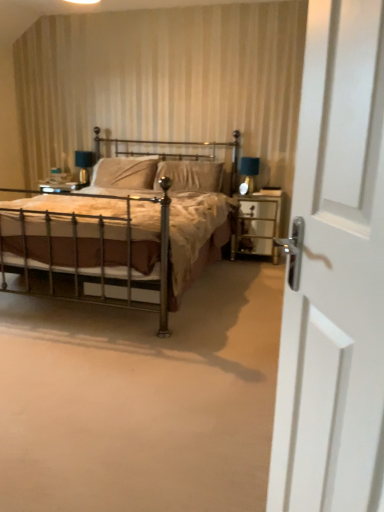
Question: From the image's perspective, is suede-like beige pillow at center, the 1th pillow in the right-to-left sequence, above or below matte black table lamp at right, which is counted as the 1th table lamp, starting from the front?

Choices:
 (A) below
 (B) above

Answer: (B)

Question: Is suede-like beige pillow at center, the 1th pillow in the right-to-left sequence, wider or thinner than matte black table lamp at right, which is counted as the 1th table lamp, starting from the front?

Choices:
 (A) thin
 (B) wide

Answer: (B)

Question: Which object is the closest to the matte black table lamp at right, which is counted as the 1th table lamp, starting from the front?

Choices:
 (A) matte blue glass table lamp at upper left, marked as the 1th table lamp in a left-to-right arrangement
 (B) suede-like beige pillow at center, which is the first pillow from left to right
 (C) suede-like beige pillow at center, the 2th pillow positioned from the left
 (D) polished brass bed at center
 (E) white glossy door at right

Answer: (C)

Question: Estimate the real-world distances between objects in this image. Which object is farther from the clear glass nightstand at right?

Choices:
 (A) matte black table lamp at right, arranged as the second table lamp when viewed from the left
 (B) white glossy door at right
 (C) suede-like beige pillow at center, the 1th pillow in the right-to-left sequence
 (D) suede-like beige pillow at center, the 2th pillow positioned from the right
 (E) polished brass bed at center

Answer: (B)